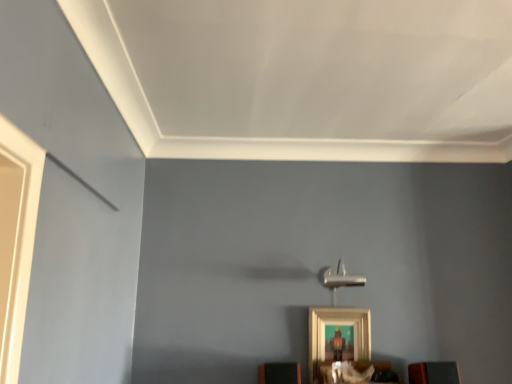
Question: Considering the relative positions of wooden shelf at lower center, the second furniture from the left, and gold metallic picture frame at lower center in the image provided, is wooden shelf at lower center, the second furniture from the left, in front of gold metallic picture frame at lower center?

Choices:
 (A) no
 (B) yes

Answer: (B)

Question: Is wooden shelf at lower center, the second furniture from the left, looking in the opposite direction of gold metallic picture frame at lower center?

Choices:
 (A) no
 (B) yes

Answer: (B)

Question: Can you confirm if wooden shelf at lower center, the second furniture from the left, is bigger than gold metallic picture frame at lower center?

Choices:
 (A) yes
 (B) no

Answer: (A)

Question: From the image's perspective, is wooden shelf at lower center, which ranks as the 2th furniture in right-to-left order, under gold metallic picture frame at lower center?

Choices:
 (A) no
 (B) yes

Answer: (B)

Question: Is wooden shelf at lower center, the second furniture from the left, in contact with gold metallic picture frame at lower center?

Choices:
 (A) yes
 (B) no

Answer: (B)

Question: In the image, is matte black speaker at lower right, arranged as the first furniture when viewed from the right, positioned in front of or behind gold metallic picture frame at lower center?

Choices:
 (A) behind
 (B) front

Answer: (B)

Question: Is point (442, 377) positioned closer to the camera than point (352, 332)?

Choices:
 (A) farther
 (B) closer

Answer: (B)

Question: From a real-world perspective, relative to gold metallic picture frame at lower center, is matte black speaker at lower right, arranged as the first furniture when viewed from the right, vertically above or below?

Choices:
 (A) above
 (B) below

Answer: (B)

Question: Which is correct: matte black speaker at lower right, which appears as the 3th furniture when viewed from the left, is inside gold metallic picture frame at lower center, or outside of it?

Choices:
 (A) outside
 (B) inside

Answer: (A)

Question: From the image's perspective, is wooden shelf at lower center, the second furniture from the left, positioned above or below matte black speaker at lower right, arranged as the first furniture when viewed from the right?

Choices:
 (A) above
 (B) below

Answer: (B)

Question: In terms of height, does wooden shelf at lower center, which ranks as the 2th furniture in right-to-left order, look taller or shorter compared to matte black speaker at lower right, which appears as the 3th furniture when viewed from the left?

Choices:
 (A) short
 (B) tall

Answer: (A)

Question: From a real-world perspective, is wooden shelf at lower center, the second furniture from the left, physically located above or below matte black speaker at lower right, which appears as the 3th furniture when viewed from the left?

Choices:
 (A) above
 (B) below

Answer: (B)

Question: Does point (362, 367) appear closer or farther from the camera than point (428, 379)?

Choices:
 (A) closer
 (B) farther

Answer: (B)

Question: Considering the positions of gold metallic picture frame at lower center and orange matte speaker at lower center, acting as the third furniture starting from the right, in the image, is gold metallic picture frame at lower center taller or shorter than orange matte speaker at lower center, acting as the third furniture starting from the right,?

Choices:
 (A) short
 (B) tall

Answer: (B)

Question: Is point (352, 316) positioned closer to the camera than point (287, 367)?

Choices:
 (A) closer
 (B) farther

Answer: (B)